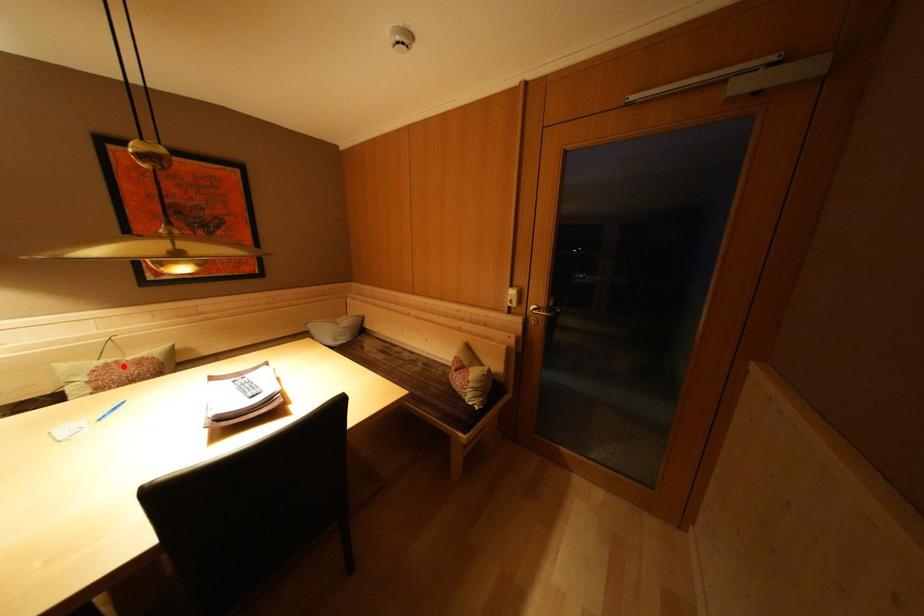
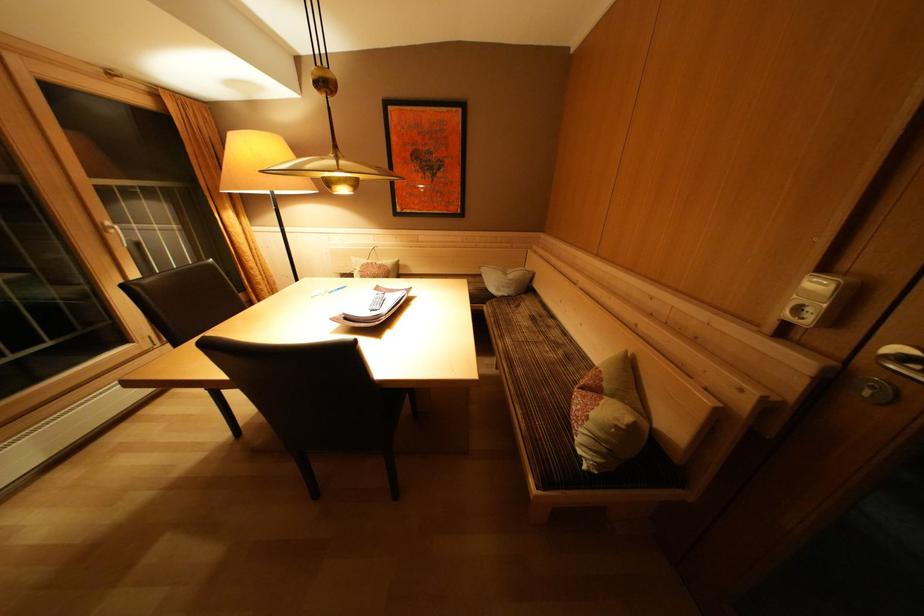
Where in the second image is the point corresponding to the highlighted location from the first image?

(379, 268)